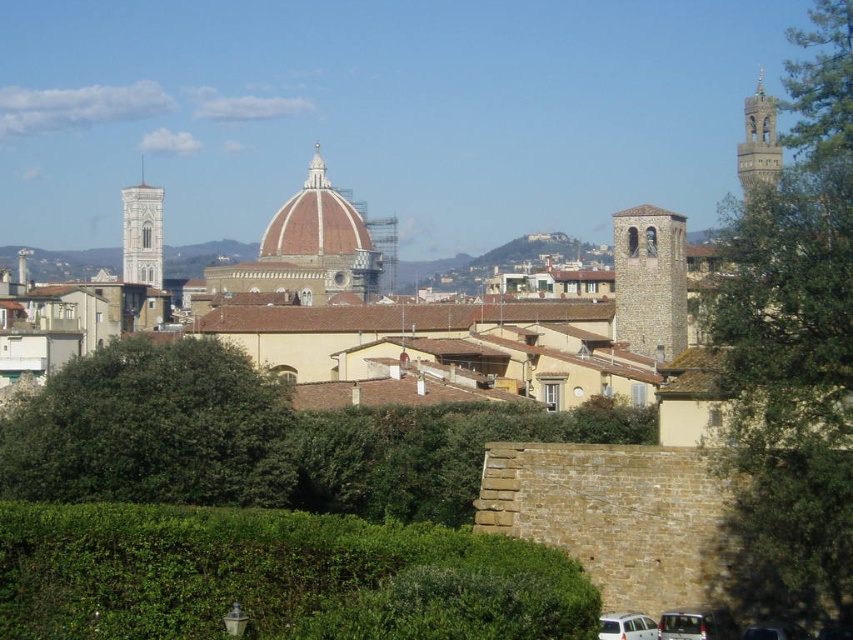
You are a tourist standing in the park area of Florence, Italy, looking at the historic cityscape with the Duomo and Giotto Bell Tower in the background. You see a silver metallic van at lower center and a metallic silver van at lower right. Which van is nearer to you?

The silver metallic van at lower center is closer to the viewer than the metallic silver van at lower right.

You are standing in the historic cityscape of Florence, Italy, as depicted in the image. There is a green leafy tree at center. Can you confirm if the point you are standing at, which is at coordinates (x=152, y=429), is under the tree?

The point at coordinates (x=152, y=429) is under the green leafy tree at center, as the object description states that the green leafy tree at center is located at that point.